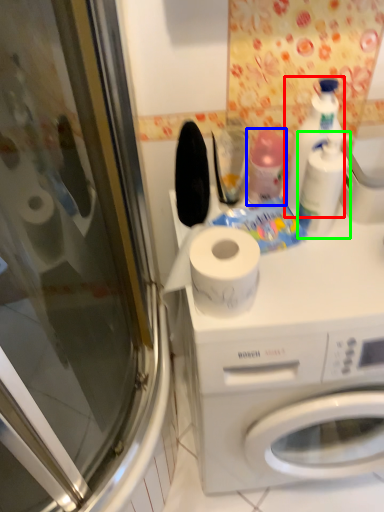
Question: Which object is positioned farthest from cleaning product (highlighted by a red box)? Select from cleaning product (highlighted by a blue box) and cleaning product (highlighted by a green box).

Choices:
 (A) cleaning product
 (B) cleaning product

Answer: (A)